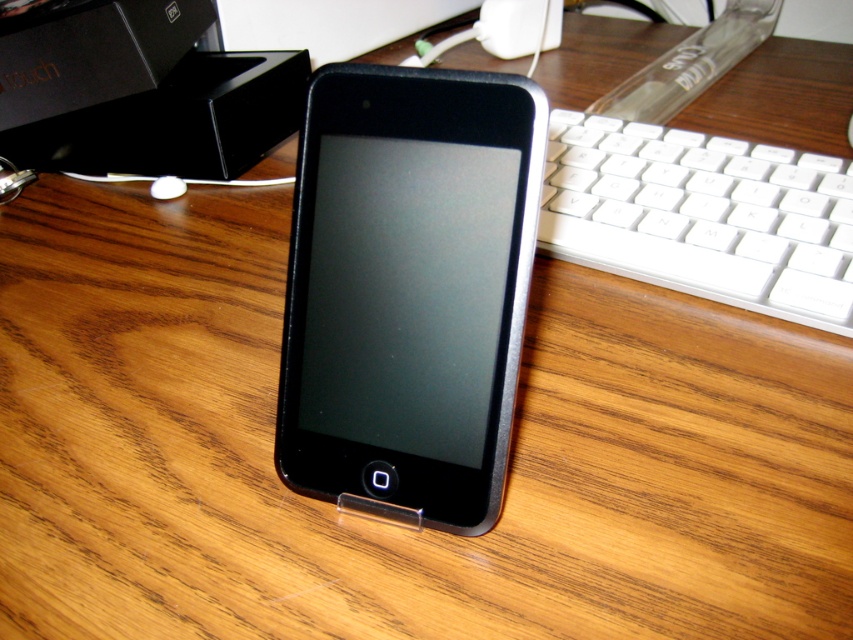
Looking at this image, you are trying to locate two points in the image. The first point is at coordinates point (317, 452) and the second point is at coordinates point (732, 212). From your perspective, which point is closer to you?

Point (317, 452) is in front of point (732, 212), so it is closer to you.

You are setting up a workspace and need to place the black matte smartphone at center and the white plastic keyboard at right on a desk. If the desk has limited vertical space, which object should you prioritize placing first to ensure both fit vertically?

The black matte smartphone at center is much taller than the white plastic keyboard at right, so you should prioritize placing the black matte smartphone at center first to accommodate its height before positioning the keyboard.

You are organizing your desk and want to place a small notebook between the black matte smartphone at center and the white plastic keyboard at right. The notebook is 15 centimeters wide. Will there be enough space between them to fit the notebook?

The black matte smartphone at center is 21.42 centimeters away from the white plastic keyboard at right. Since the notebook is 15 centimeters wide, there is enough space between them to fit the notebook as 15 cm is less than 21.42 cm.